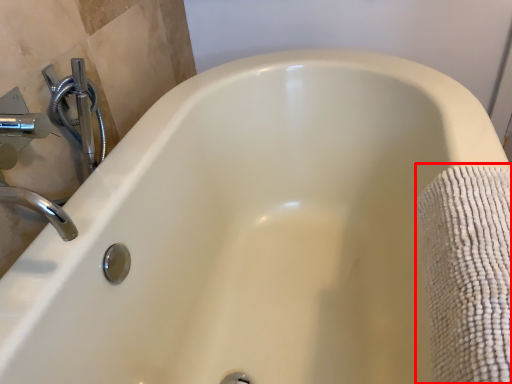
Question: From the image's perspective, where is bath towel (annotated by the red box) located in relation to plumbing fixture in the image?

Choices:
 (A) above
 (B) below

Answer: (B)